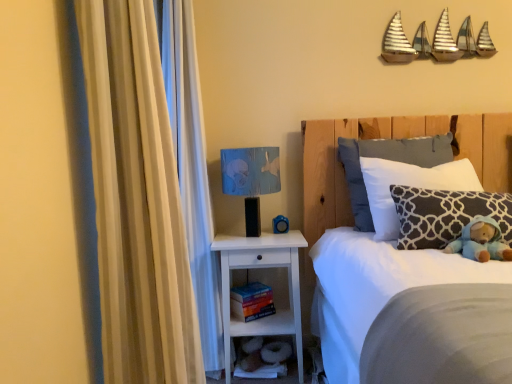
Question: Does white wood nightstand at lower center have a lesser height compared to beige fabric curtain at left?

Choices:
 (A) yes
 (B) no

Answer: (A)

Question: Is white wood nightstand at lower center aimed at beige fabric curtain at left?

Choices:
 (A) no
 (B) yes

Answer: (B)

Question: From the image's perspective, is white wood nightstand at lower center on beige fabric curtain at left?

Choices:
 (A) no
 (B) yes

Answer: (A)

Question: Considering the relative positions of white wood nightstand at lower center and beige fabric curtain at left in the image provided, is white wood nightstand at lower center in front of beige fabric curtain at left?

Choices:
 (A) yes
 (B) no

Answer: (B)

Question: Is white wood nightstand at lower center to the right of beige fabric curtain at left from the viewer's perspective?

Choices:
 (A) yes
 (B) no

Answer: (A)

Question: From a real-world perspective, is blue fabric lampshade at upper right positioned above or below beige fabric curtain at left?

Choices:
 (A) below
 (B) above

Answer: (A)

Question: From the image's perspective, is blue fabric lampshade at upper right above or below beige fabric curtain at left?

Choices:
 (A) below
 (B) above

Answer: (B)

Question: From their relative heights in the image, would you say blue fabric lampshade at upper right is taller or shorter than beige fabric curtain at left?

Choices:
 (A) tall
 (B) short

Answer: (B)

Question: Looking at the image, does blue fabric lampshade at upper right seem bigger or smaller compared to beige fabric curtain at left?

Choices:
 (A) big
 (B) small

Answer: (B)

Question: From the image's perspective, is beige fabric curtain at left located above or below hardcover book at lower center?

Choices:
 (A) above
 (B) below

Answer: (A)

Question: Based on their positions, is beige fabric curtain at left located to the left or right of hardcover book at lower center?

Choices:
 (A) right
 (B) left

Answer: (B)

Question: From a real-world perspective, is beige fabric curtain at left physically located above or below hardcover book at lower center?

Choices:
 (A) below
 (B) above

Answer: (B)

Question: Considering the positions of point click(x=177, y=372) and point click(x=259, y=306), is point click(x=177, y=372) closer or farther from the camera than point click(x=259, y=306)?

Choices:
 (A) closer
 (B) farther

Answer: (A)

Question: In the image, is blue rubber duck at lower center positioned in front of or behind hardcover book at lower center?

Choices:
 (A) front
 (B) behind

Answer: (B)

Question: Looking at the image, does blue rubber duck at lower center seem bigger or smaller compared to hardcover book at lower center?

Choices:
 (A) small
 (B) big

Answer: (A)